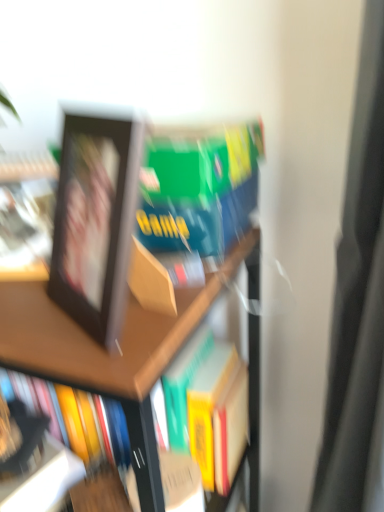
The image size is (384, 512). In order to click on free space in front of matte black photo frame at left in this screenshot , I will do `click(41, 322)`.